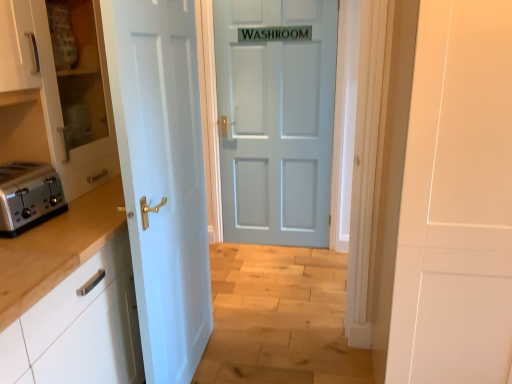
The height and width of the screenshot is (384, 512). I want to click on free spot to the right of satin silver toaster at left, so click(85, 215).